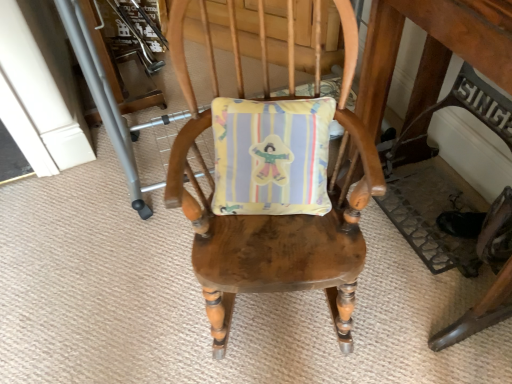
Question: In terms of height, does wooden table at center look taller or shorter compared to wooden chair at center?

Choices:
 (A) tall
 (B) short

Answer: (A)

Question: Visually, is wooden table at center positioned to the left or to the right of wooden chair at center?

Choices:
 (A) right
 (B) left

Answer: (A)

Question: Is point (409, 100) closer or farther from the camera than point (327, 220)?

Choices:
 (A) closer
 (B) farther

Answer: (B)

Question: Does point (357, 135) appear closer or farther from the camera than point (413, 6)?

Choices:
 (A) farther
 (B) closer

Answer: (A)

Question: From a real-world perspective, is wooden chair at center physically located above or below wooden table at center?

Choices:
 (A) below
 (B) above

Answer: (A)

Question: Is wooden chair at center wider or thinner than wooden table at center?

Choices:
 (A) wide
 (B) thin

Answer: (A)

Question: From the image's perspective, is wooden chair at center above or below wooden table at center?

Choices:
 (A) above
 (B) below

Answer: (B)